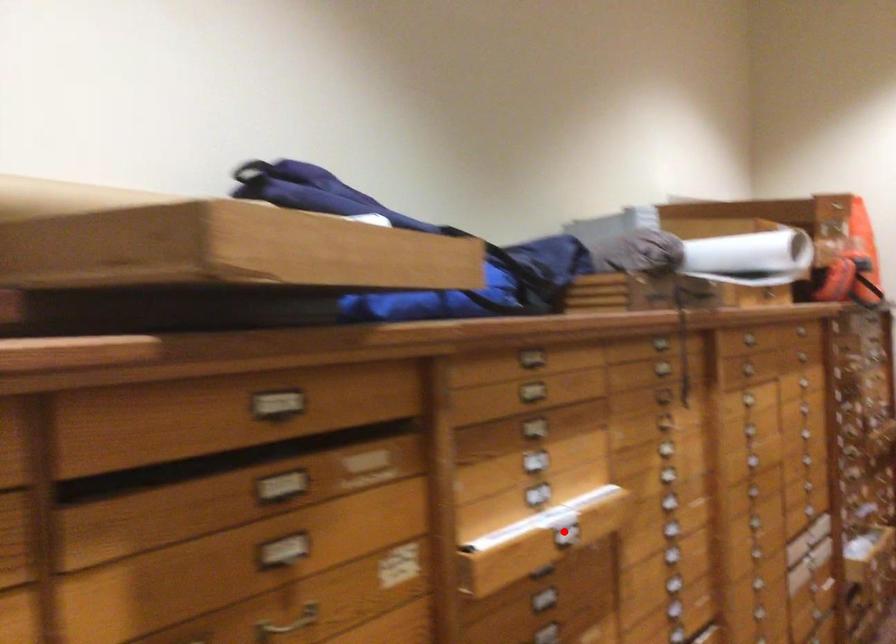
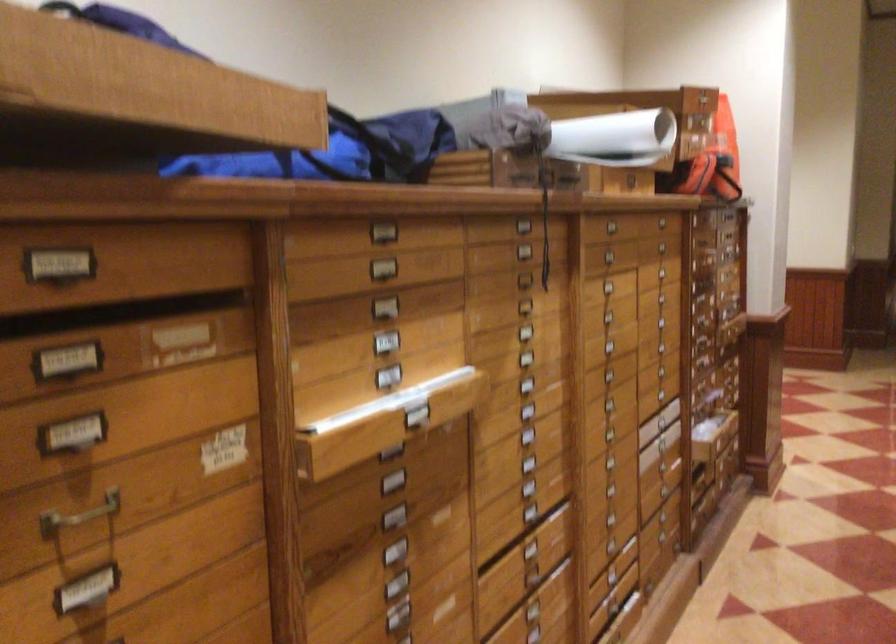
Find the pixel in the second image that matches the highlighted location in the first image.

(416, 411)